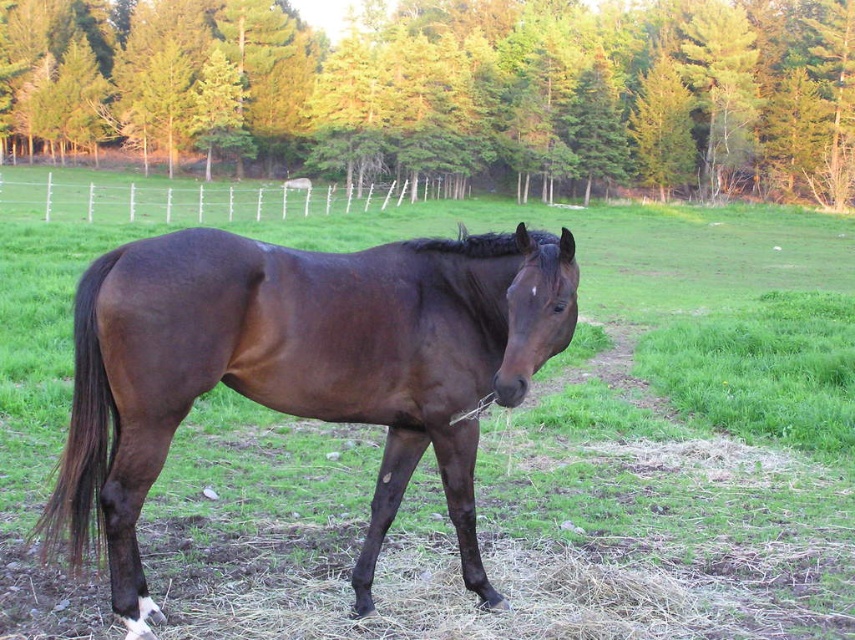
In the scene shown: You are standing in the field and want to walk towards the green leafy trees at upper center. Which direction should you head?

The green leafy trees at upper center are located at point (447, 92), so you should head towards the upper center direction to reach them.